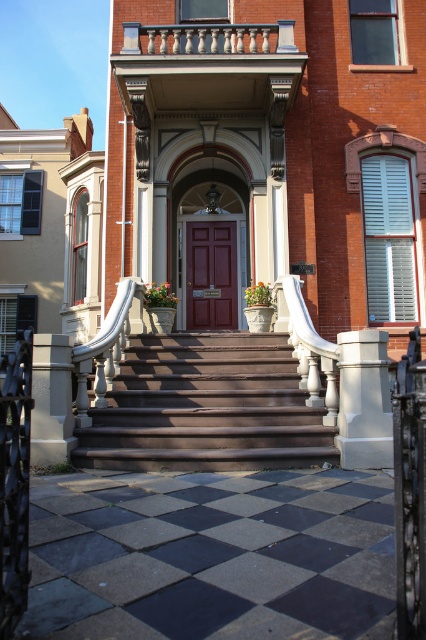
Question: Does white stone pillar at lower left appear under white marble balustrade at upper center?

Choices:
 (A) no
 (B) yes

Answer: (B)

Question: Does brown polished wood stairs at center appear on the left side of matte wood door at center?

Choices:
 (A) no
 (B) yes

Answer: (A)

Question: Among these points, which one is farthest from the camera?

Choices:
 (A) (232, 260)
 (B) (155, 38)
 (C) (40, 365)

Answer: (A)

Question: Can you confirm if brown polished wood stairs at center is positioned above white marble balustrade at upper center?

Choices:
 (A) yes
 (B) no

Answer: (B)

Question: Estimate the real-world distances between objects in this image. Which object is farther from the brown polished wood stairs at center?

Choices:
 (A) white stone pillar at lower left
 (B) white marble balustrade at upper center
 (C) white stone column at center

Answer: (B)

Question: Which object appears closest to the camera in this image?

Choices:
 (A) brown polished wood stairs at center
 (B) white marble balustrade at upper center
 (C) white stone pillar at lower left

Answer: (C)